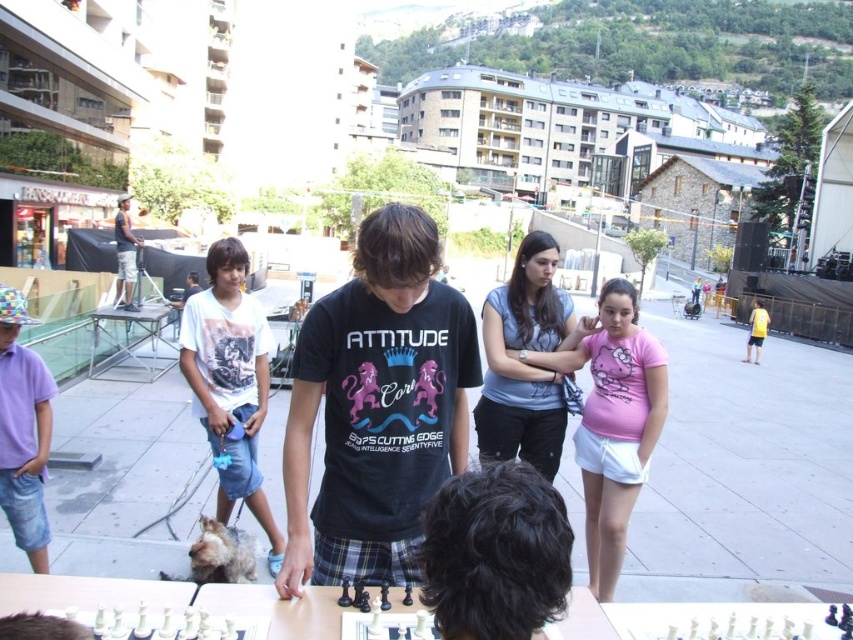
Question: Observing the image, what is the correct spatial positioning of black cotton shirt at center in reference to dark blue denim shorts at left?

Choices:
 (A) below
 (B) above

Answer: (A)

Question: Is black cotton shirt at center to the right of light blue cotton shirt at center from the viewer's perspective?

Choices:
 (A) yes
 (B) no

Answer: (B)

Question: Among these points, which one is farthest from the camera?

Choices:
 (A) (x=132, y=268)
 (B) (x=192, y=397)

Answer: (A)

Question: Estimate the real-world distances between objects in this image. Which object is farther from the dark blue denim shorts at left?

Choices:
 (A) white printed t-shirt at center
 (B) black cotton shirt at center
 (C) light blue cotton shirt at center

Answer: (A)

Question: Which is farther from the black cotton shirt at center?

Choices:
 (A) pink cotton shirt at center
 (B) white printed t-shirt at center
 (C) light blue cotton shirt at center
 (D) dark blue denim shorts at left

Answer: (D)

Question: Can you confirm if pink cotton shirt at center is positioned above dark blue denim shorts at left?

Choices:
 (A) no
 (B) yes

Answer: (A)